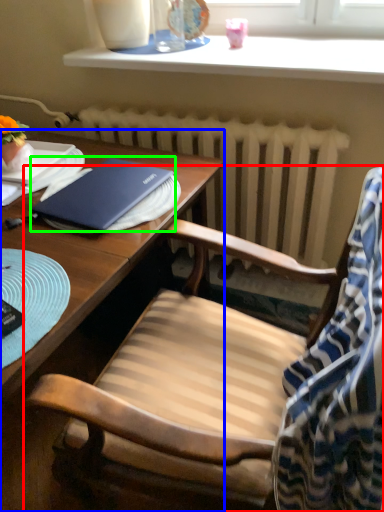
Question: Estimate the real-world distances between objects in this image. Which object is closer to chair (highlighted by a red box), desk (highlighted by a blue box) or notebook (highlighted by a green box)?

Choices:
 (A) desk
 (B) notebook

Answer: (B)